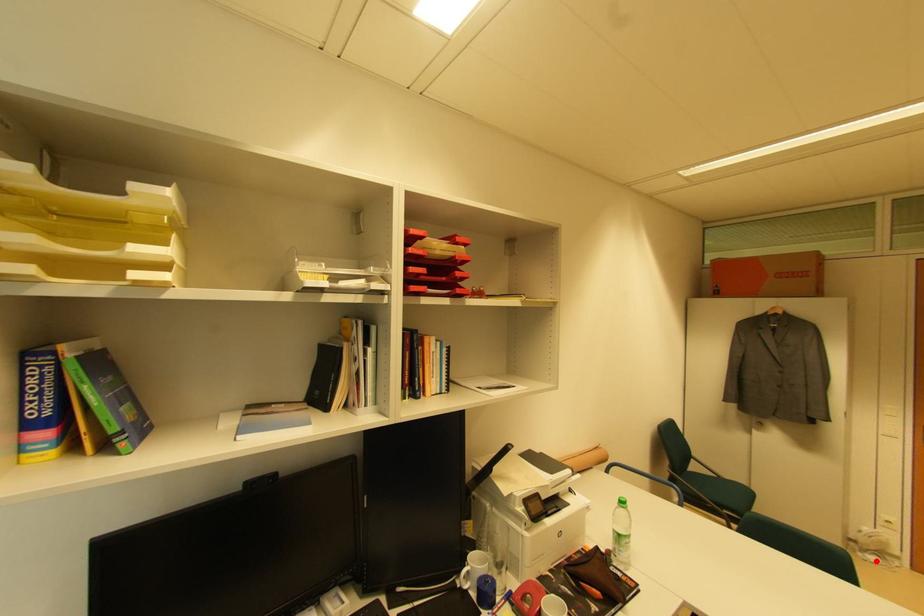
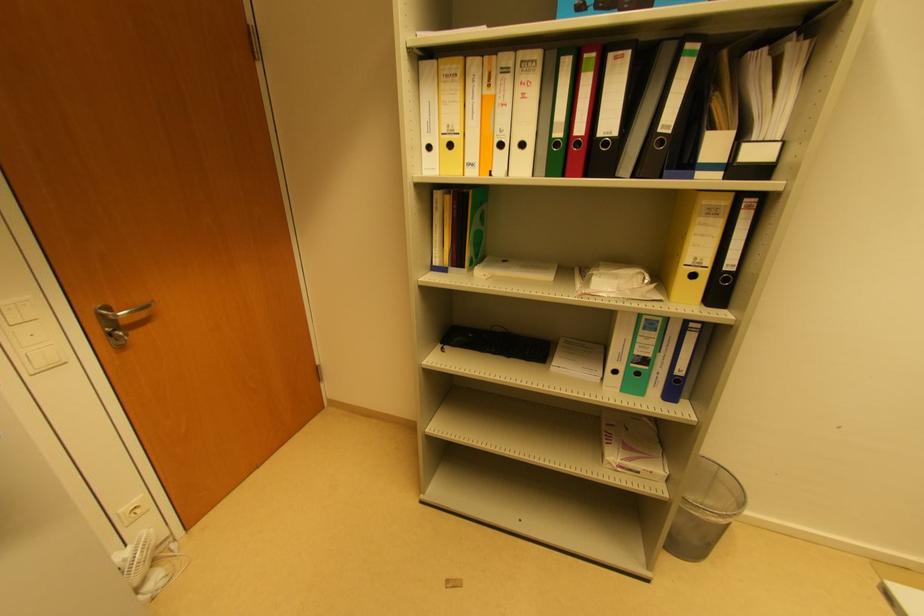
Question: I am providing you with two images of the same scene from different viewpoints. Given a red point in image1, look at the same physical point in image2. Is it:

Choices:
 (A) Closer to the viewpoint
 (B) Farther from the viewpoint

Answer: (A)